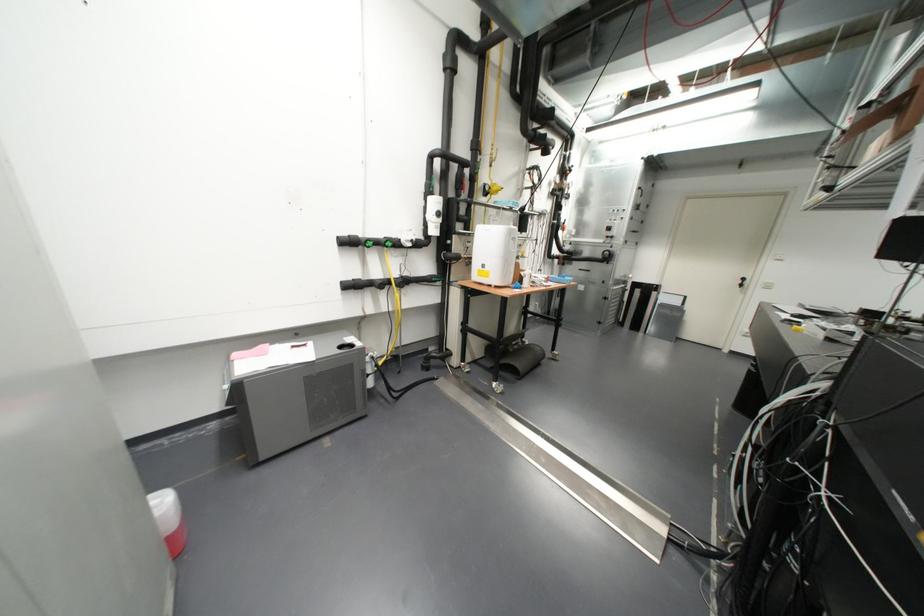
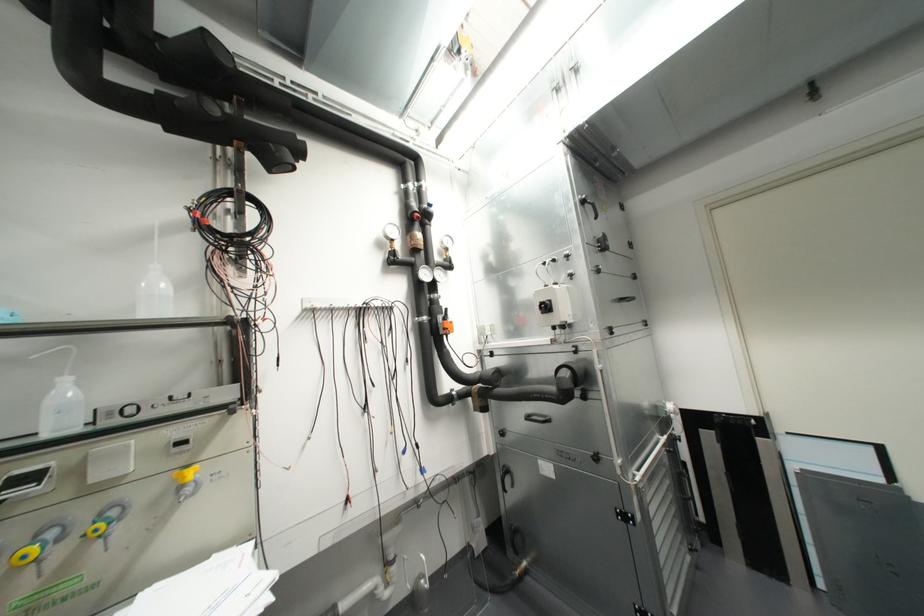
Locate, in the second image, the point that corresponds to pixel 638 188 in the first image.

(582, 201)